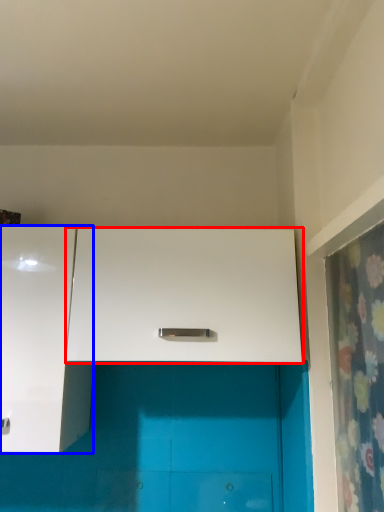
Question: Which object is further to the camera taking this photo, cabinetry (highlighted by a red box) or cabinetry (highlighted by a blue box)?

Choices:
 (A) cabinetry
 (B) cabinetry

Answer: (A)